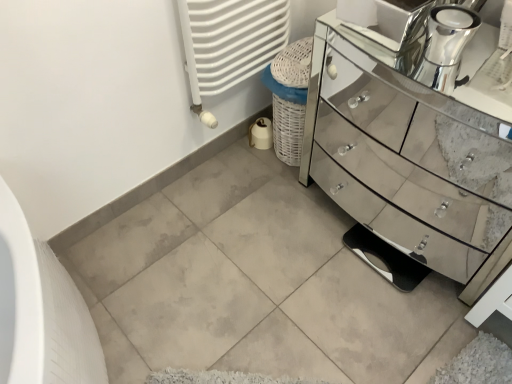
Question: From the image's perspective, is mirror-finished glass chest of drawers at right on top of white textured radiator at upper center?

Choices:
 (A) no
 (B) yes

Answer: (A)

Question: Can white textured radiator at upper center be found inside mirror-finished glass chest of drawers at right?

Choices:
 (A) no
 (B) yes

Answer: (A)

Question: Does mirror-finished glass chest of drawers at right appear on the left side of white textured radiator at upper center?

Choices:
 (A) no
 (B) yes

Answer: (A)

Question: Is mirror-finished glass chest of drawers at right shorter than white textured radiator at upper center?

Choices:
 (A) yes
 (B) no

Answer: (B)

Question: Considering the relative sizes of mirror-finished glass chest of drawers at right and white textured radiator at upper center in the image provided, is mirror-finished glass chest of drawers at right thinner than white textured radiator at upper center?

Choices:
 (A) no
 (B) yes

Answer: (A)

Question: Choose the correct answer: Is chrome metallic faucet at upper right inside mirror-finished glass chest of drawers at right or outside it?

Choices:
 (A) inside
 (B) outside

Answer: (B)

Question: In terms of size, does chrome metallic faucet at upper right appear bigger or smaller than mirror-finished glass chest of drawers at right?

Choices:
 (A) small
 (B) big

Answer: (A)

Question: Considering their positions, is chrome metallic faucet at upper right located in front of or behind mirror-finished glass chest of drawers at right?

Choices:
 (A) front
 (B) behind

Answer: (B)

Question: From a real-world perspective, is chrome metallic faucet at upper right physically located above or below mirror-finished glass chest of drawers at right?

Choices:
 (A) below
 (B) above

Answer: (B)

Question: Is white textured radiator at upper center spatially inside mirror-finished glass chest of drawers at right, or outside of it?

Choices:
 (A) inside
 (B) outside

Answer: (B)

Question: Is white textured radiator at upper center taller or shorter than mirror-finished glass chest of drawers at right?

Choices:
 (A) short
 (B) tall

Answer: (A)

Question: From a real-world perspective, relative to mirror-finished glass chest of drawers at right, is white textured radiator at upper center vertically above or below?

Choices:
 (A) above
 (B) below

Answer: (A)

Question: Is white textured radiator at upper center in front of or behind mirror-finished glass chest of drawers at right in the image?

Choices:
 (A) behind
 (B) front

Answer: (A)

Question: Is chrome metallic faucet at upper right wider or thinner than white textured radiator at upper center?

Choices:
 (A) thin
 (B) wide

Answer: (A)

Question: Looking at the image, does chrome metallic faucet at upper right seem bigger or smaller compared to white textured radiator at upper center?

Choices:
 (A) small
 (B) big

Answer: (A)